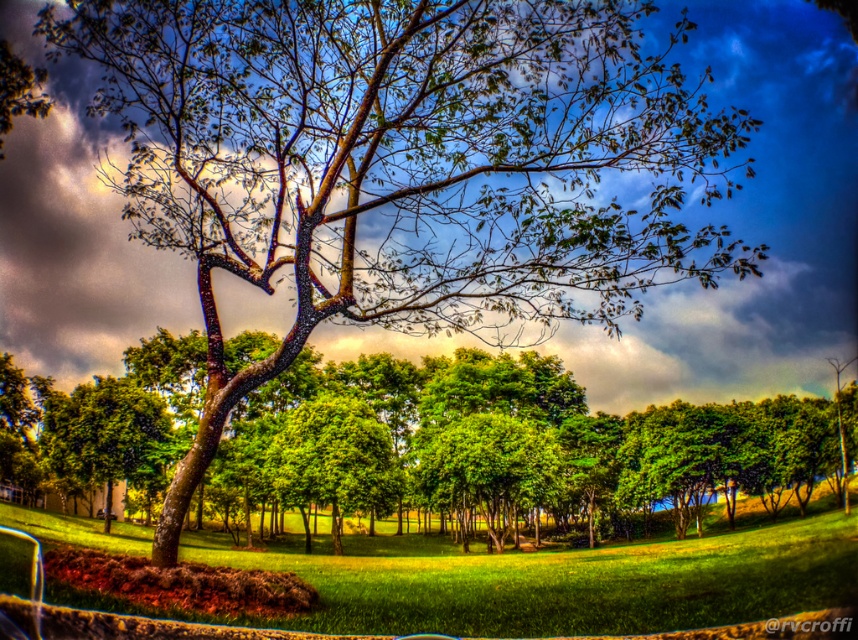
Looking at this image, you are standing at the point with coordinates point (372,564) and want to walk towards the point with coordinates point (612,445). Will the tree with thick trunk and sprawling branches block your path?

Point (612,445) is behind point (372,564), so the tree with thick trunk and sprawling branches will block your path.